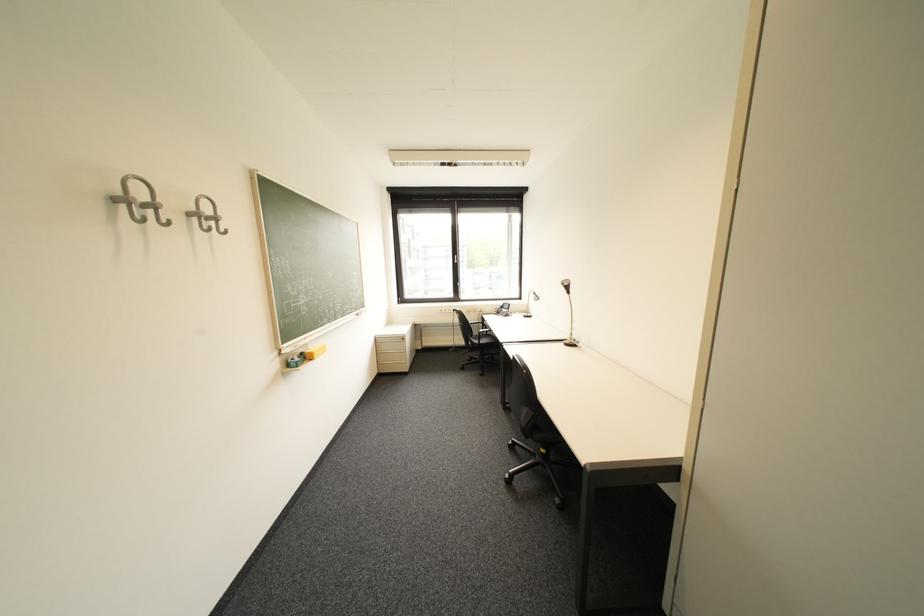
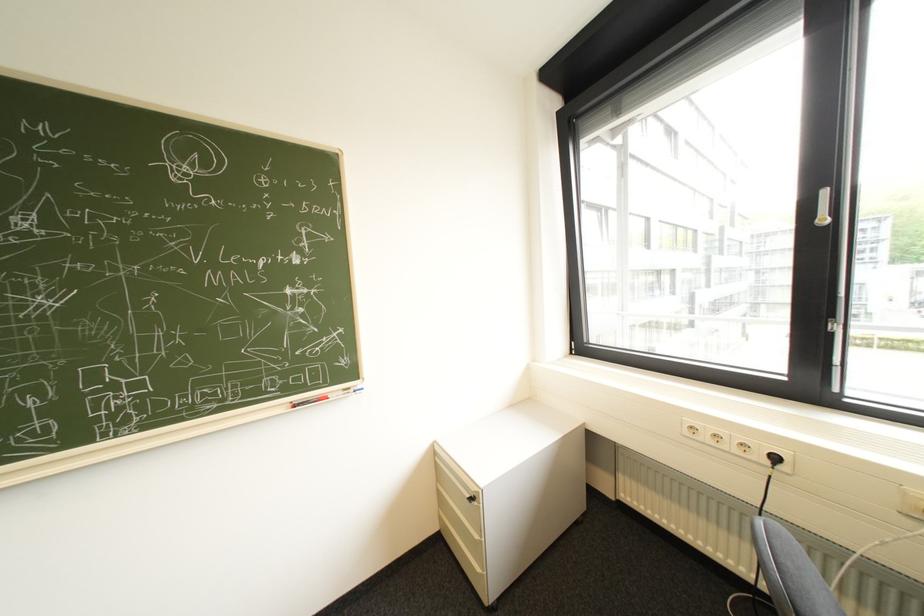
In the second image, find the point that corresponds to [451,313] in the first image.

(698, 434)